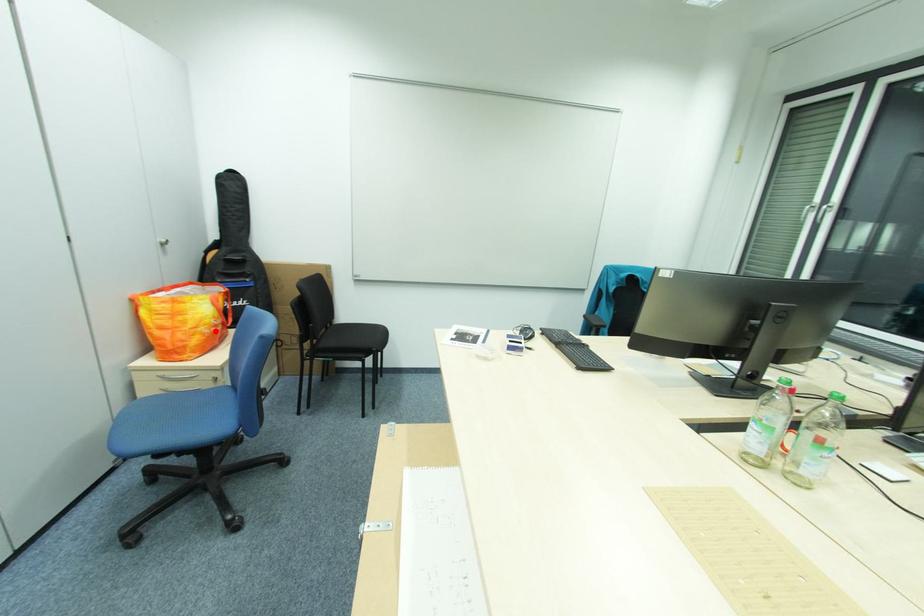
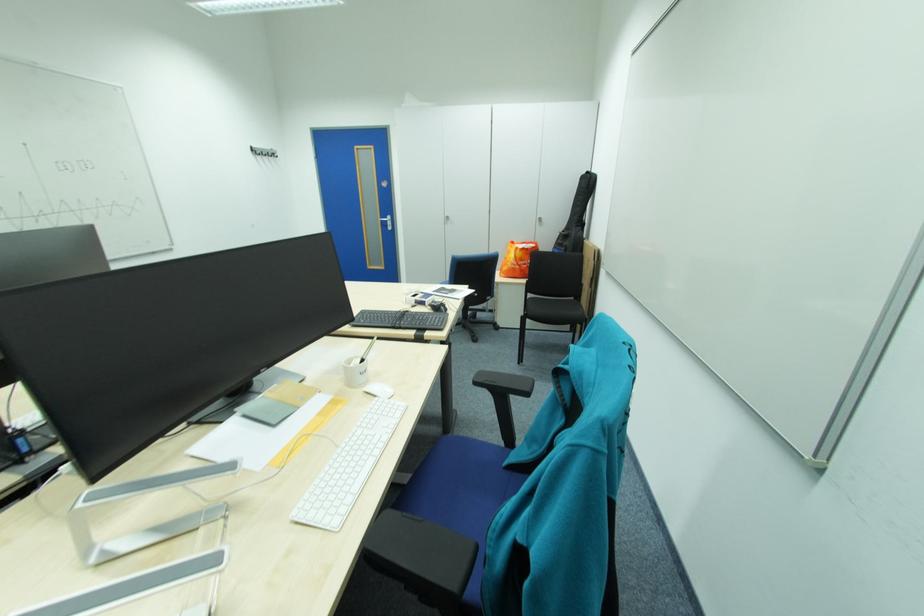
The point at the highlighted location is marked in the first image. Where is the corresponding point in the second image?

(517, 265)